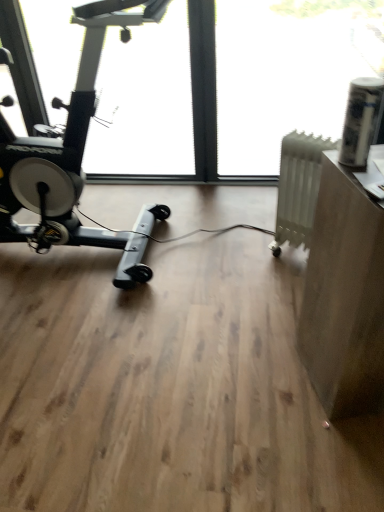
Identify the location of free spot in front of matte brown desk at right. This screenshot has width=384, height=512. (340, 459).